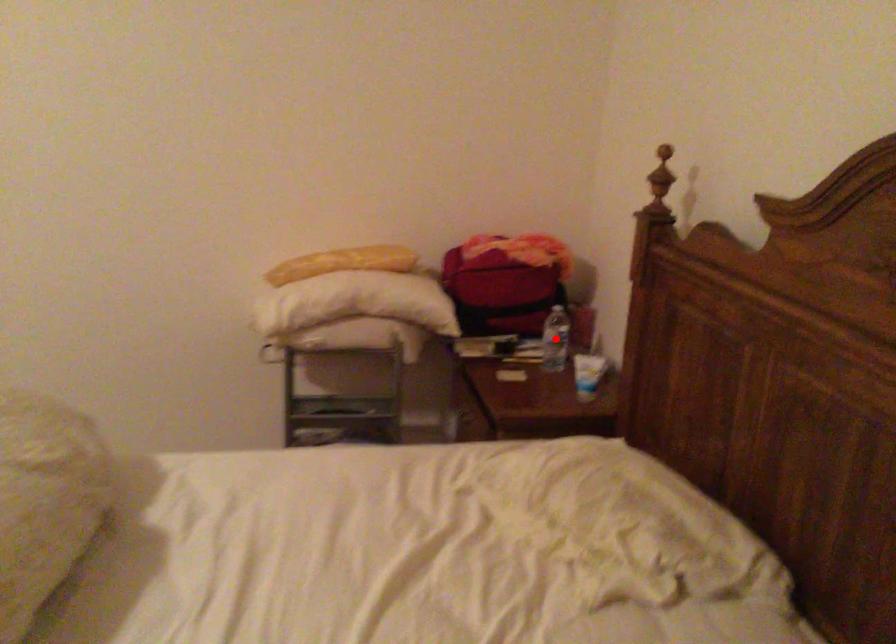
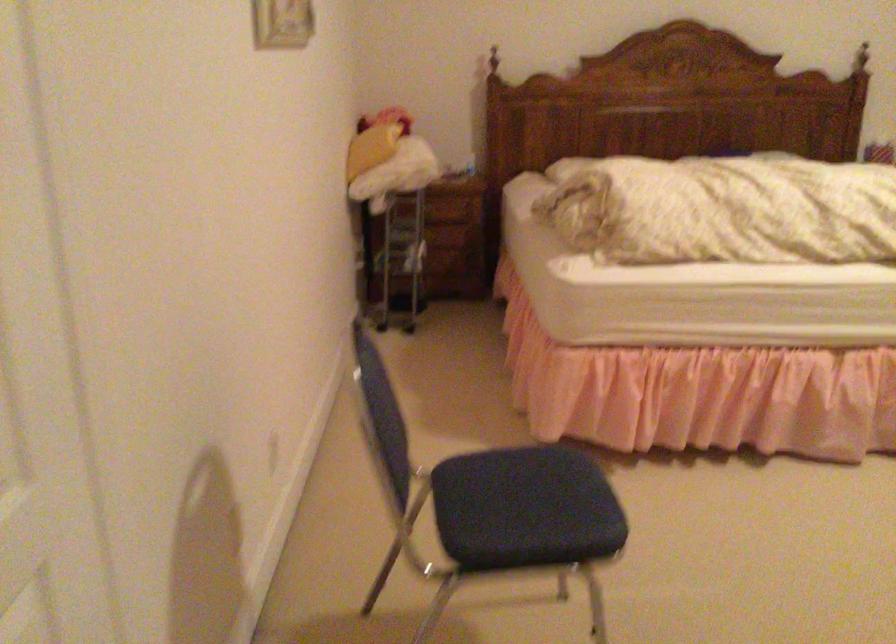
Question: I am providing you with two images of the same scene from different viewpoints. A red point is marked on the first image. Can you still see the location of the red point in image 2?

Choices:
 (A) Yes
 (B) No

Answer: (B)